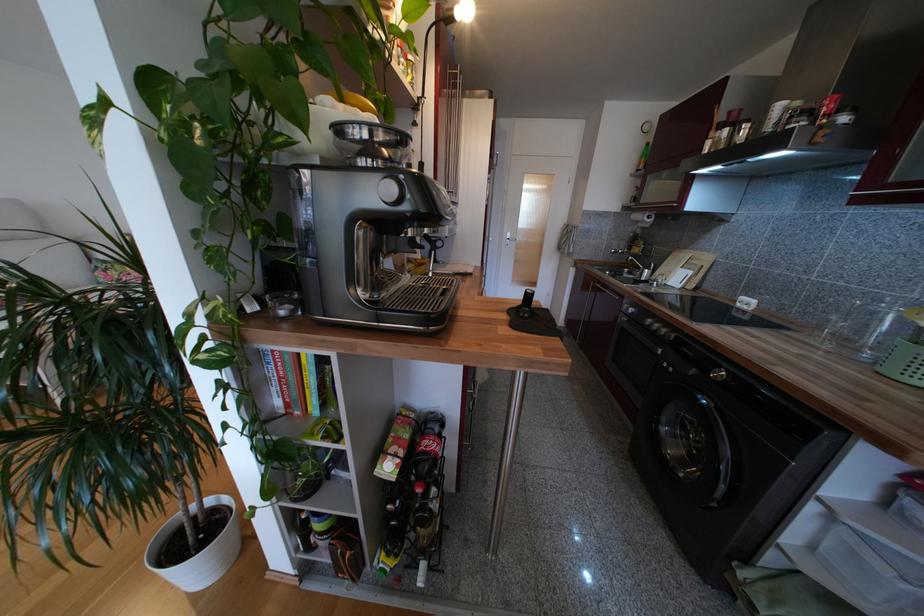
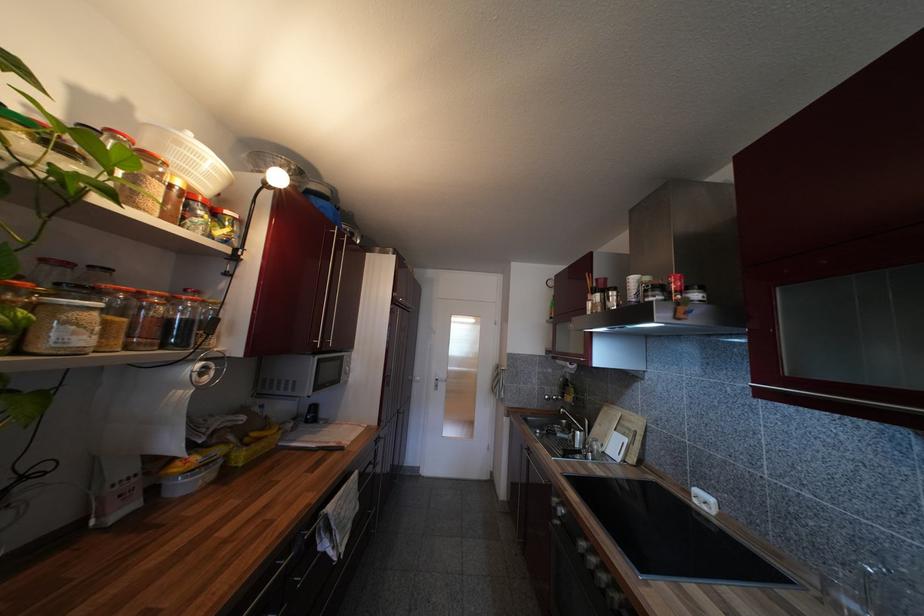
Where in the second image is the point corresponding to [624,321] from the first image?

(554, 525)